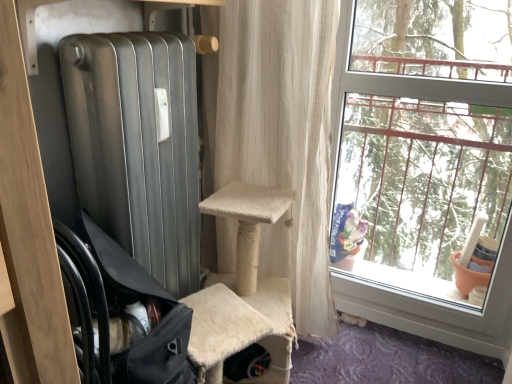
Question: Considering the positions of black fabric chair at left and white textured curtain at center in the image, is black fabric chair at left wider or thinner than white textured curtain at center?

Choices:
 (A) wide
 (B) thin

Answer: (A)

Question: Is black fabric chair at left situated inside white textured curtain at center or outside?

Choices:
 (A) outside
 (B) inside

Answer: (A)

Question: Which of these objects is positioned closest to the white textured curtain at center?

Choices:
 (A) clear glass window at right
 (B) black fabric chair at left

Answer: (A)

Question: Considering the real-world distances, which object is farthest from the black fabric chair at left?

Choices:
 (A) white textured curtain at center
 (B) clear glass window at right

Answer: (B)